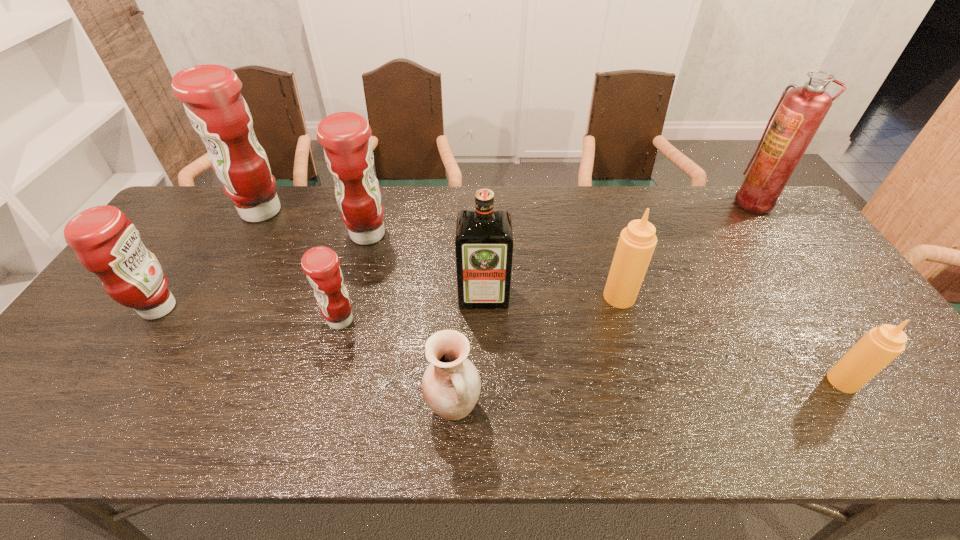
This screenshot has height=540, width=960. What are the coordinates of `vacant space at the left edge of the desktop` in the screenshot? It's located at (48, 388).

This screenshot has width=960, height=540. In order to click on free space at the right edge of the desktop in this screenshot , I will do `click(808, 257)`.

At what (x,y) coordinates should I click in order to perform the action: click on blank space at the far left corner of the desktop. Please return your answer as a coordinate pair (x, y). This screenshot has width=960, height=540. Looking at the image, I should click on (178, 214).

You are a GUI agent. You are given a task and a screenshot of the screen. Output one action in this format:
    pyautogui.click(x=<x>, y=<y>)
    Task: Click on the unoccupied position between the smallest red condiment and the pink pottery
    The image size is (960, 540).
    Given the screenshot: What is the action you would take?
    pyautogui.click(x=396, y=363)

Identify the location of free space that is in between the red fire extinguisher and the pink pottery. This screenshot has height=540, width=960. (604, 305).

This screenshot has height=540, width=960. I want to click on unoccupied area between the smallest red condiment and the third smallest red condiment, so click(x=354, y=278).

Locate an element on the screen. This screenshot has height=540, width=960. free area in between the third object from right to left and the nearest condiment is located at coordinates (731, 339).

Locate an element on the screen. The width and height of the screenshot is (960, 540). vacant point located between the red fire extinguisher and the left tan condiment is located at coordinates (686, 249).

Identify the location of free spot between the liquor and the second biggest red condiment. (425, 265).

Identify the location of free space between the second smallest red condiment and the tallest condiment. 210,260.